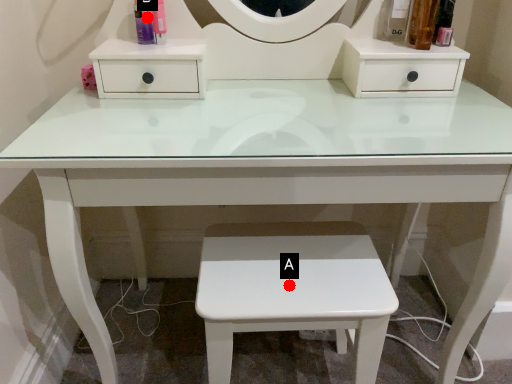
Question: Two points are circled on the image, labeled by A and B beside each circle. Among these points, which one is farthest from the camera?

Choices:
 (A) A is further
 (B) B is further

Answer: (B)